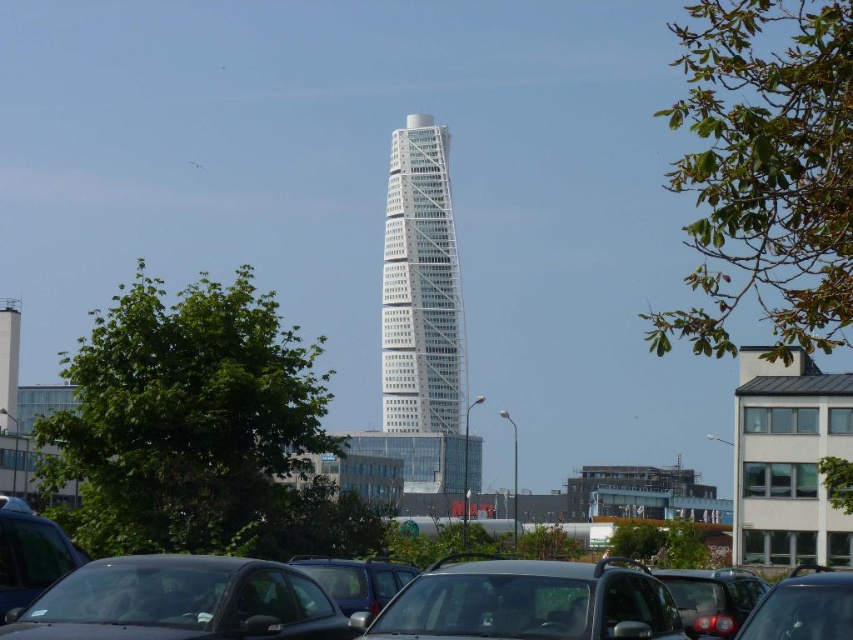
Question: Is matte black car at center smaller than matte black car at lower center?

Choices:
 (A) yes
 (B) no

Answer: (B)

Question: Can you confirm if black matte car at lower center is smaller than matte black car at lower center?

Choices:
 (A) yes
 (B) no

Answer: (A)

Question: Among these objects, which one is nearest to the camera?

Choices:
 (A) shiny black car at lower right
 (B) black matte car at lower center
 (C) matte black car at lower left

Answer: (A)

Question: Does black matte car at lower center appear under matte black car at lower center?

Choices:
 (A) yes
 (B) no

Answer: (B)

Question: Which object is closer to the camera taking this photo?

Choices:
 (A) matte black car at center
 (B) shiny black car at lower right
 (C) matte black car at lower center
 (D) white glass tower at center

Answer: (A)

Question: Among these objects, which one is farthest from the camera?

Choices:
 (A) matte black car at lower left
 (B) white glass tower at center

Answer: (B)